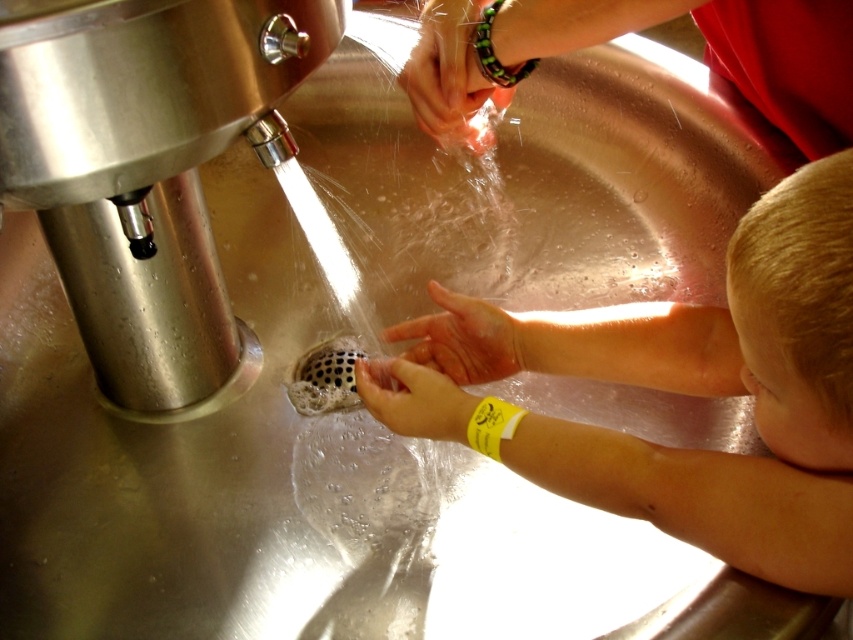
Question: Is matte black bracelet at upper center bigger than smooth skin hand at center?

Choices:
 (A) no
 (B) yes

Answer: (B)

Question: Is satin nickel faucet at lower left closer to the viewer compared to matte black bracelet at upper center?

Choices:
 (A) yes
 (B) no

Answer: (A)

Question: Based on their relative distances, which object is nearer to the smooth skin hands at center?

Choices:
 (A) smooth skin hand at center
 (B) satin nickel faucet at lower left

Answer: (A)

Question: Considering the real-world distances, which object is farthest from the matte black bracelet at upper center?

Choices:
 (A) smooth skin hands at center
 (B) yellow rubber band at lower center
 (C) satin nickel faucet at lower left
 (D) smooth skin hand at center

Answer: (A)

Question: Can you confirm if matte black bracelet at upper center is wider than yellow rubber band at lower center?

Choices:
 (A) yes
 (B) no

Answer: (A)

Question: Which point is farther to the camera?

Choices:
 (A) matte black bracelet at upper center
 (B) yellow rubber band at lower center
 (C) smooth skin hands at center
 (D) satin nickel faucet at lower left

Answer: (A)